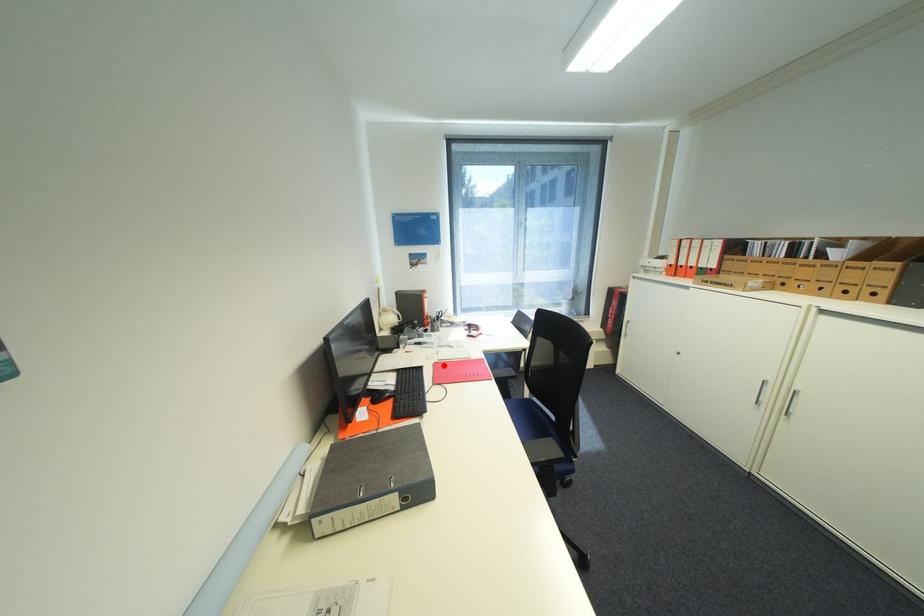
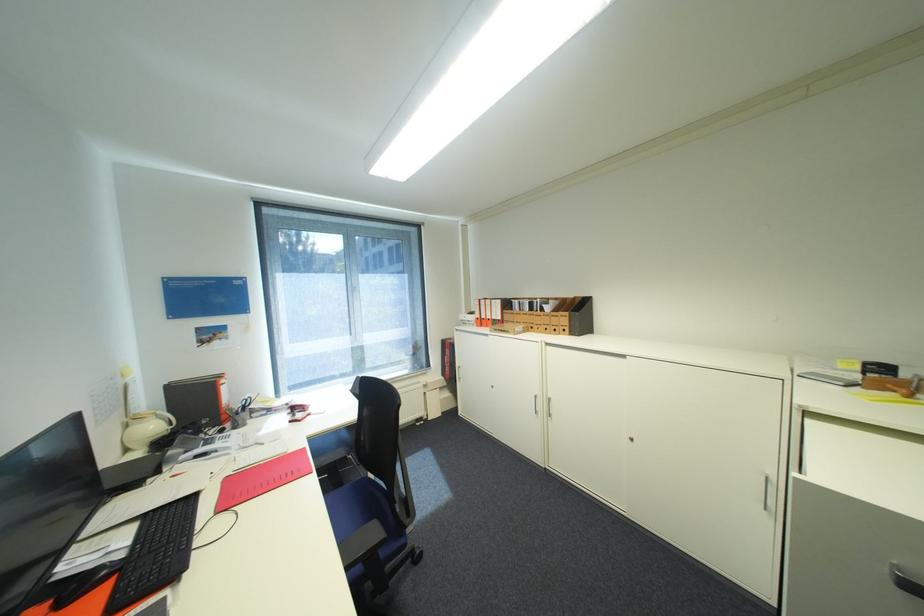
In the second image, find the point that corresponds to the highlighted location in the first image.

(235, 480)